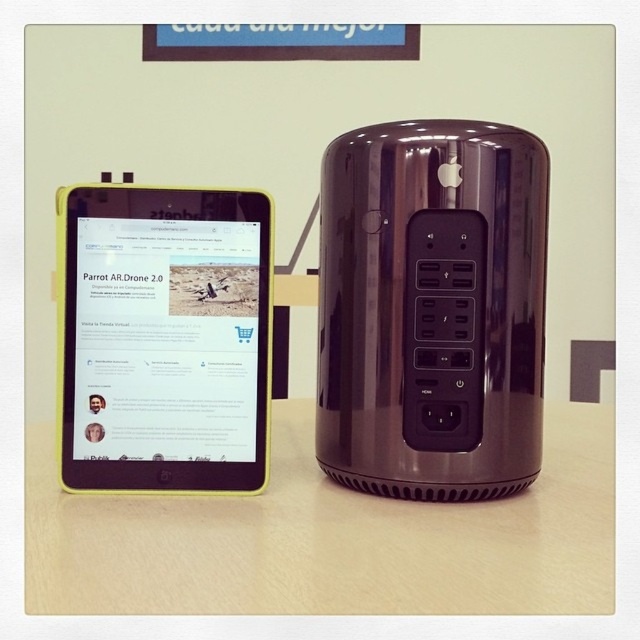
Question: Based on their relative distances, which object is nearer to the yellow plastic tablet at left?

Choices:
 (A) wooden table at center
 (B) satin black ipod at right

Answer: (B)

Question: Which of the following is the closest to the observer?

Choices:
 (A) satin black ipod at right
 (B) wooden table at center
 (C) yellow plastic tablet at left

Answer: (B)

Question: Does wooden table at center appear on the right side of yellow plastic tablet at left?

Choices:
 (A) no
 (B) yes

Answer: (B)

Question: Does satin black ipod at right have a lesser width compared to wooden table at center?

Choices:
 (A) yes
 (B) no

Answer: (A)

Question: Which of the following is the farthest from the observer?

Choices:
 (A) satin black ipod at right
 (B) yellow plastic tablet at left

Answer: (B)

Question: Can you confirm if wooden table at center is positioned below yellow plastic tablet at left?

Choices:
 (A) yes
 (B) no

Answer: (A)